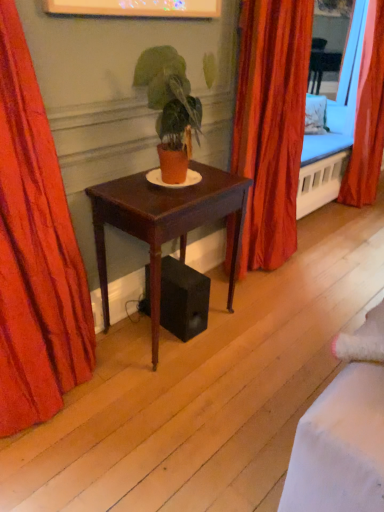
The width and height of the screenshot is (384, 512). Find the location of `free space above mahogany wood desk at center (from a real-world perspective)`. free space above mahogany wood desk at center (from a real-world perspective) is located at coordinates (181, 190).